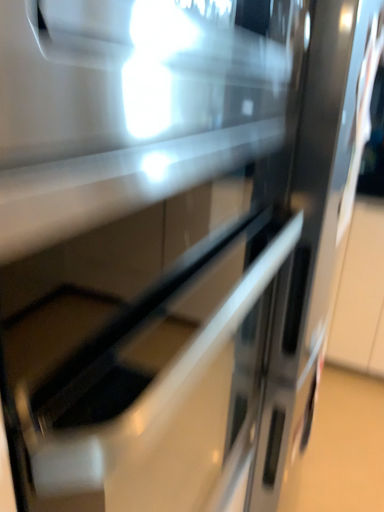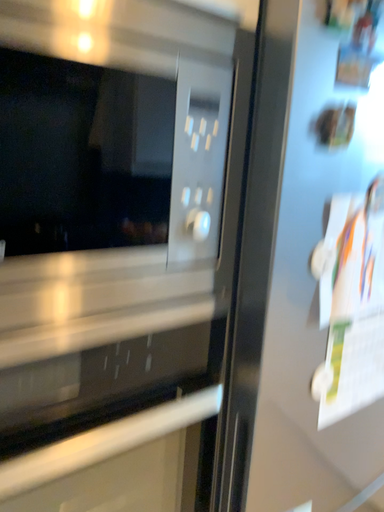
Question: How did the camera likely rotate when shooting the video?

Choices:
 (A) rotated left
 (B) rotated right

Answer: (A)